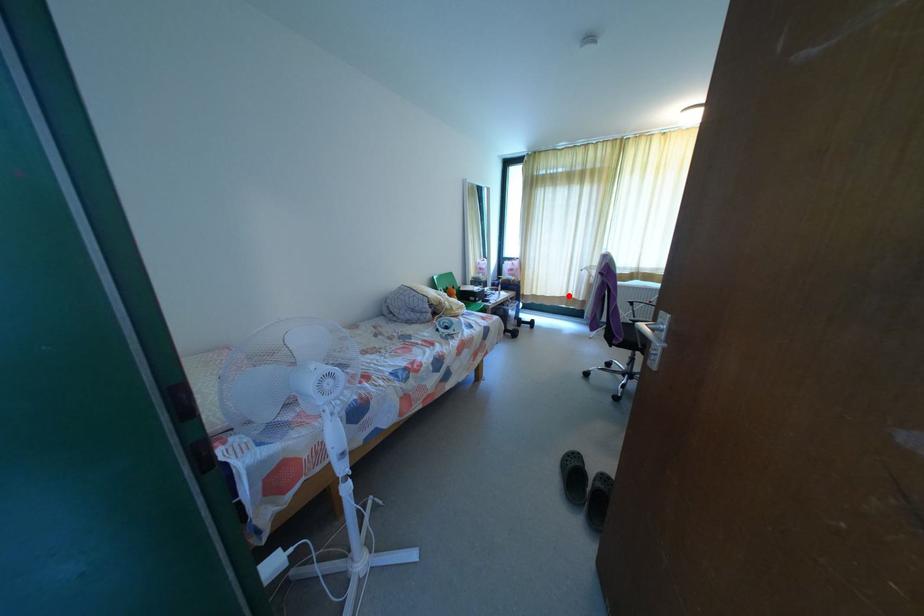
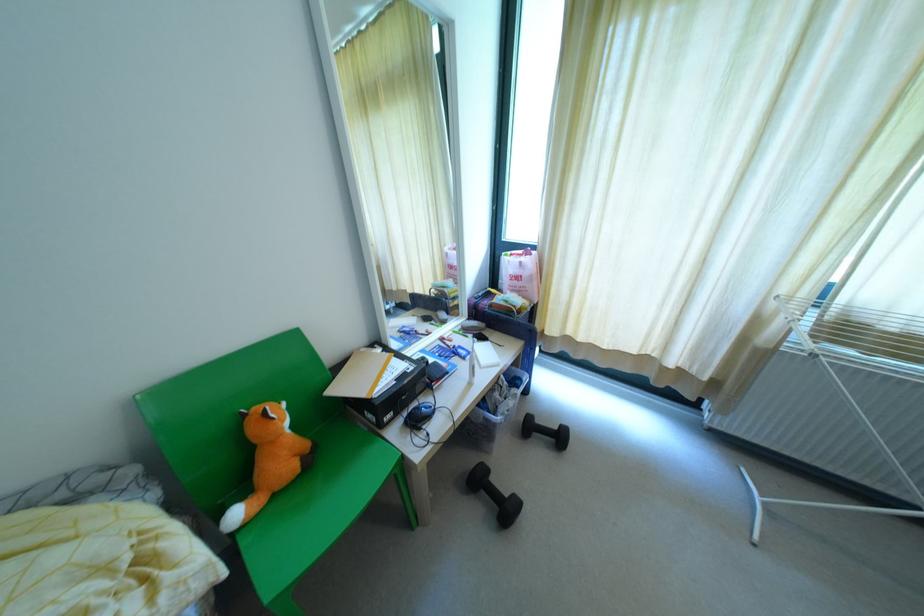
Where in the second image is the point corresponding to the highlighted location from the first image?

(670, 363)